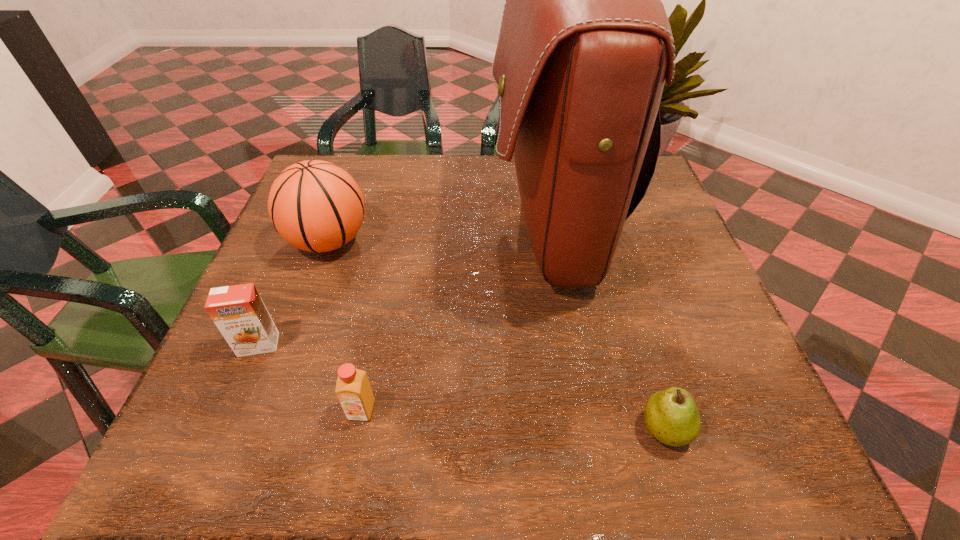
Where is `vacant area situated on the back of the fourth shortest object`? This screenshot has width=960, height=540. vacant area situated on the back of the fourth shortest object is located at coordinates (360, 154).

Find the location of a particular element. free space located on the front of the third farthest object is located at coordinates (227, 421).

Identify the location of vacant position located on the front and back of the shorter orange juice. The image size is (960, 540). (350, 467).

You are a GUI agent. You are given a task and a screenshot of the screen. Output one action in this format:
    pyautogui.click(x=<x>, y=<y>)
    Task: Click on the free region located 0.210m on the back of the pear
    This screenshot has height=540, width=960.
    Given the screenshot: What is the action you would take?
    pyautogui.click(x=628, y=307)

You are a GUI agent. You are given a task and a screenshot of the screen. Output one action in this format:
    pyautogui.click(x=<x>, y=<y>)
    Task: Click on the object that is at the far edge
    This screenshot has width=960, height=540.
    Given the screenshot: What is the action you would take?
    pyautogui.click(x=585, y=44)

Where is `orange juice present at the near edge`? This screenshot has height=540, width=960. orange juice present at the near edge is located at coordinates (353, 390).

At what (x,y) coordinates should I click in order to perform the action: click on pear that is at the near edge. Please return your answer as a coordinate pair (x, y). The image size is (960, 540). Looking at the image, I should click on (671, 415).

Image resolution: width=960 pixels, height=540 pixels. Identify the location of basketball present at the left edge. pos(316,206).

This screenshot has height=540, width=960. I want to click on orange juice present at the left edge, so click(x=238, y=311).

Image resolution: width=960 pixels, height=540 pixels. What are the coordinates of `satchel that is at the right edge` in the screenshot? It's located at (585, 44).